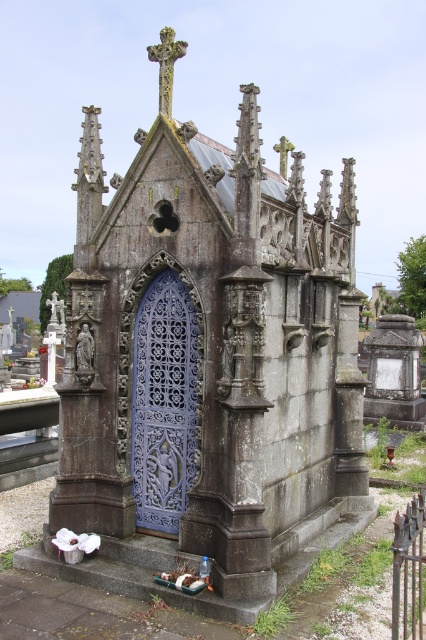
Question: Does rusty stone mausoleum at center appear on the left side of blue metallic door at center?

Choices:
 (A) yes
 (B) no

Answer: (B)

Question: Is rusty stone mausoleum at center bigger than blue metallic door at center?

Choices:
 (A) yes
 (B) no

Answer: (A)

Question: Does rusty stone mausoleum at center appear under blue metallic door at center?

Choices:
 (A) yes
 (B) no

Answer: (B)